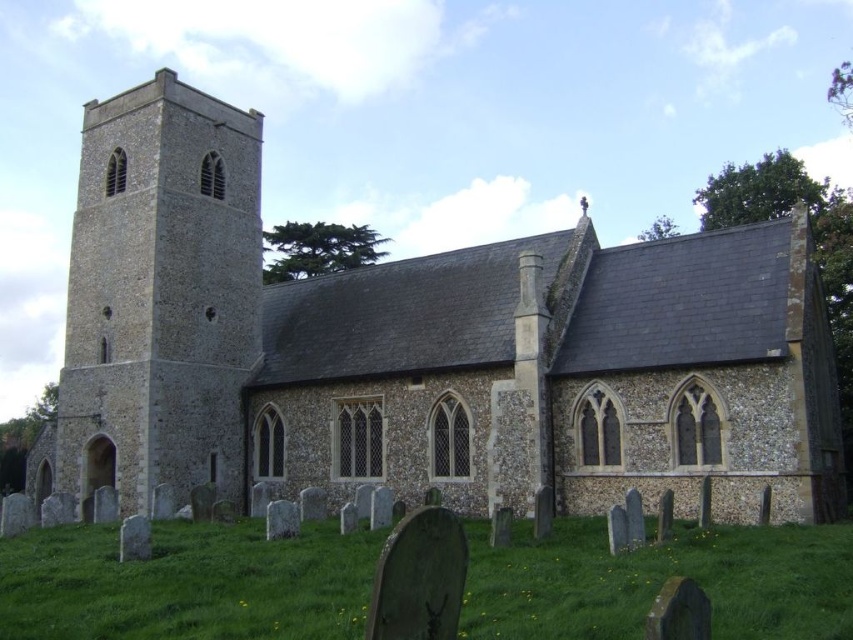
Is stone church at center smaller than green grass at lower center?

No, stone church at center is not smaller than green grass at lower center.

Locate an element on the screen. The width and height of the screenshot is (853, 640). stone church at center is located at coordinates (422, 349).

Does green grass at lower center have a greater width compared to stone tower at left?

Indeed, green grass at lower center has a greater width compared to stone tower at left.

Where is `green grass at lower center`? This screenshot has height=640, width=853. green grass at lower center is located at coordinates (x=187, y=582).

Which of these two, stone church at center or stone tower at left, stands taller?

stone tower at left

Which is behind, point (532, 451) or point (206, 278)?

Point (206, 278)

At what (x,y) coordinates should I click in order to perform the action: click on stone church at center. Please return your answer as a coordinate pair (x, y). The image size is (853, 640). Looking at the image, I should click on (422, 349).